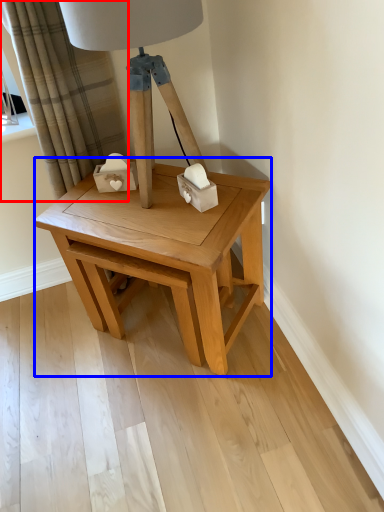
Question: Which object appears closest to the camera in this image, curtain (highlighted by a red box) or table (highlighted by a blue box)?

Choices:
 (A) curtain
 (B) table

Answer: (B)